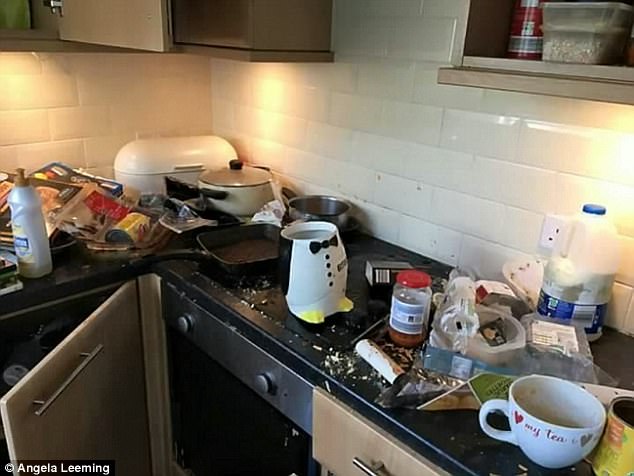
I want to click on pot, so click(230, 189).